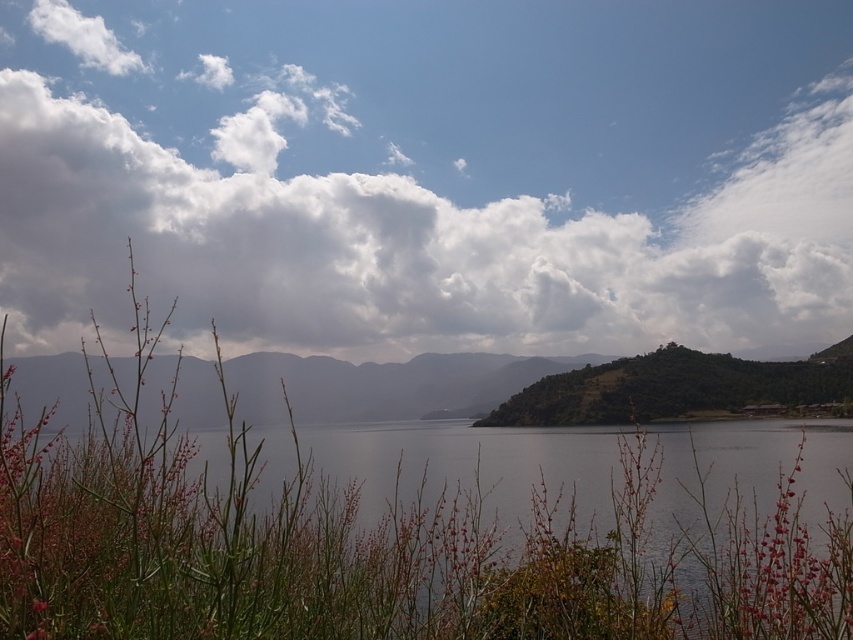
Question: Does white fluffy cloud at upper center appear on the right side of smooth gray water at center?

Choices:
 (A) yes
 (B) no

Answer: (A)

Question: Which object appears closest to the camera in this image?

Choices:
 (A) white fluffy cloud at upper center
 (B) green textured hillside at center

Answer: (B)

Question: From the image, what is the correct spatial relationship of white fluffy cloud at upper center in relation to smooth gray water at center?

Choices:
 (A) right
 (B) left

Answer: (A)

Question: Estimate the real-world distances between objects in this image. Which object is closer to the white fluffy cloud at upper center?

Choices:
 (A) smooth gray water at center
 (B) green textured hillside at center

Answer: (B)

Question: Which object is the closest to the smooth gray water at center?

Choices:
 (A) white fluffy cloud at upper center
 (B) green textured hillside at center

Answer: (B)

Question: Observing the image, what is the correct spatial positioning of white fluffy cloud at upper center in reference to smooth gray water at center?

Choices:
 (A) below
 (B) above

Answer: (B)